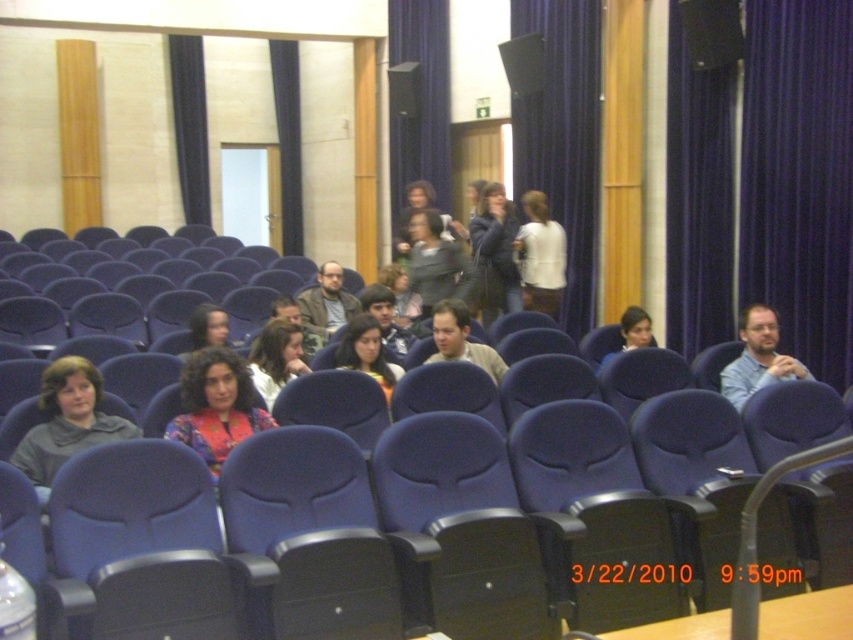
Question: Is purple fabric curtain at upper center further to the viewer compared to matte black hair at center?

Choices:
 (A) yes
 (B) no

Answer: (A)

Question: Considering the relative positions of blue fabric curtain at upper center and matte black jacket at center in the image provided, where is blue fabric curtain at upper center located with respect to matte black jacket at center?

Choices:
 (A) below
 (B) above

Answer: (B)

Question: Does blue fabric chair at center have a greater width compared to gray fleece sweater at lower left?

Choices:
 (A) no
 (B) yes

Answer: (B)

Question: Which point appears farthest from the camera in this image?

Choices:
 (A) (517, 248)
 (B) (621, 314)
 (C) (462, 252)
 (D) (440, 344)

Answer: (B)

Question: Estimate the real-world distances between objects in this image. Which object is closer to the matte gray scarf at upper center?

Choices:
 (A) blue fabric curtain at upper center
 (B) dark blue jacket at center

Answer: (B)

Question: Which point is farther to the camera?

Choices:
 (A) (279, 65)
 (B) (479, 349)
 (C) (761, 365)
 (D) (547, 253)

Answer: (A)